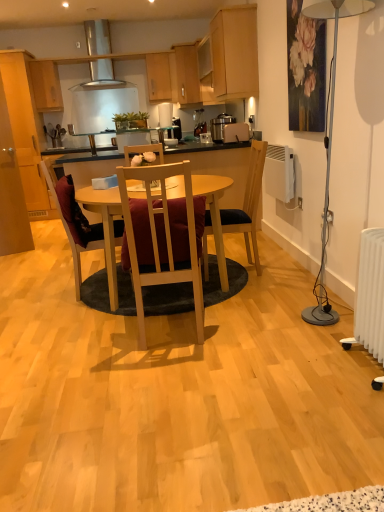
Question: In the image, is white plastic radiator at lower right on the left side or the right side of metallic silver toaster at upper center?

Choices:
 (A) left
 (B) right

Answer: (B)

Question: Do you think white plastic radiator at lower right is within metallic silver toaster at upper center, or outside of it?

Choices:
 (A) inside
 (B) outside

Answer: (B)

Question: Estimate the real-world distances between objects in this image. Which object is closer to the light wood cabinet at upper center, the fifth cabinetry positioned from the left?

Choices:
 (A) wooden cabinet at upper center, which appears as the 4th cabinetry when viewed from the left
 (B) wooden cabinet at upper center, which ranks as the 3th cabinetry in left-to-right order
 (C) white plastic radiator at lower right
 (D) matte wood cabinets at upper left, acting as the 1th cabinetry starting from the left
 (E) matte wood cabinet at upper left, which is the 4th cabinetry in right-to-left order

Answer: (A)

Question: Estimate the real-world distances between objects in this image. Which object is farther from the light wood cabinet at upper center, the fifth cabinetry positioned from the left?

Choices:
 (A) light wood table at center
 (B) silver metallic floor lamp at right
 (C) white plastic radiator at lower right
 (D) wooden cabinet at upper center, the second cabinetry viewed from the right
 (E) wooden cabinet at upper center, which is the 3th cabinetry from right to left

Answer: (C)